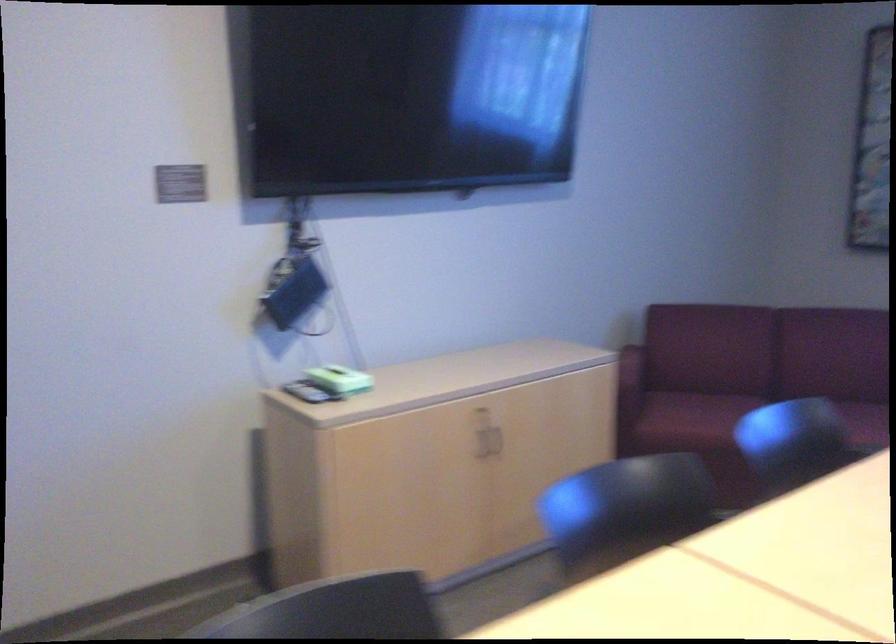
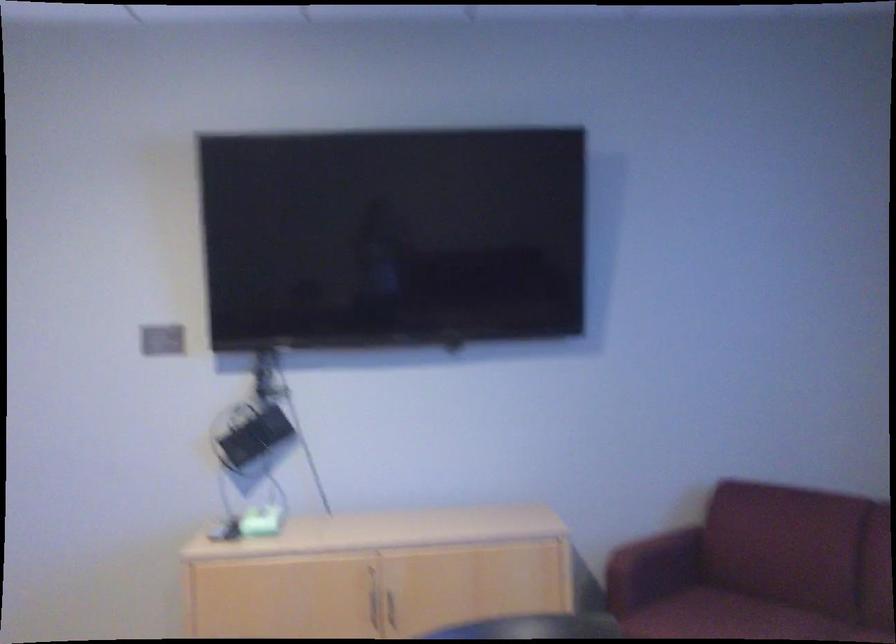
In the second image, find the point that corresponds to point (348, 377) in the first image.

(257, 522)